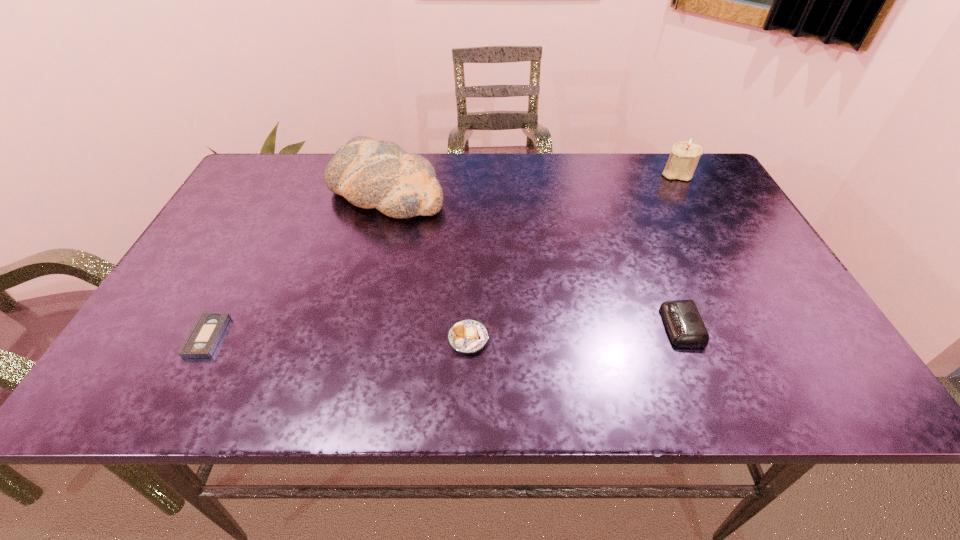
This screenshot has width=960, height=540. Find the location of `bread`. bread is located at coordinates (370, 174).

Identify the location of the rightmost object. This screenshot has width=960, height=540. (684, 157).

Locate an element on the screen. The image size is (960, 540). alarm clock is located at coordinates (683, 322).

The height and width of the screenshot is (540, 960). What are the coordinates of `pastry` in the screenshot? It's located at (467, 336).

Identify the location of the shortest object. The width and height of the screenshot is (960, 540). (206, 333).

Where is `videotape`? Image resolution: width=960 pixels, height=540 pixels. videotape is located at coordinates (206, 333).

The width and height of the screenshot is (960, 540). Identify the location of blank area located on the front of the second object from left to right. (367, 269).

This screenshot has width=960, height=540. I want to click on free space located 0.070m on the front of the rightmost object, so 690,197.

I want to click on free space located on the display of the second object from right to left, so click(x=546, y=326).

Where is `vacant space located 0.340m on the display of the second object from right to left`? vacant space located 0.340m on the display of the second object from right to left is located at coordinates (497, 326).